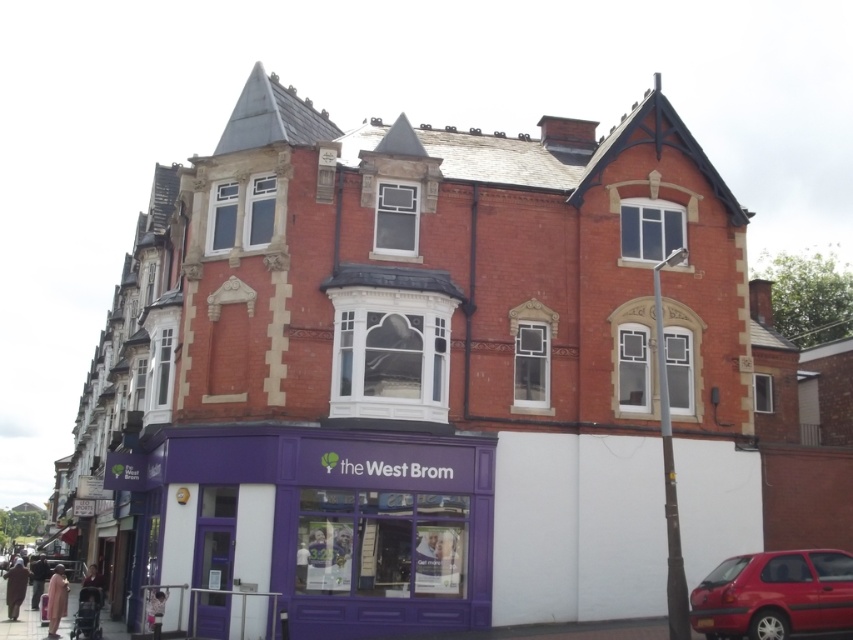
Question: Which of the following is the closest to the observer?

Choices:
 (A) shiny red car at lower right
 (B) purple matte storefront at lower left

Answer: (A)

Question: Is purple matte storefront at lower left smaller than shiny red car at lower right?

Choices:
 (A) no
 (B) yes

Answer: (A)

Question: Which of the following is the farthest from the observer?

Choices:
 (A) shiny red car at lower right
 (B) purple matte storefront at lower left

Answer: (B)

Question: Which point is farther to the camera?

Choices:
 (A) shiny red car at lower right
 (B) purple matte storefront at lower left

Answer: (B)

Question: Is purple matte storefront at lower left thinner than shiny red car at lower right?

Choices:
 (A) yes
 (B) no

Answer: (B)

Question: Where is purple matte storefront at lower left located in relation to shiny red car at lower right in the image?

Choices:
 (A) above
 (B) below

Answer: (A)